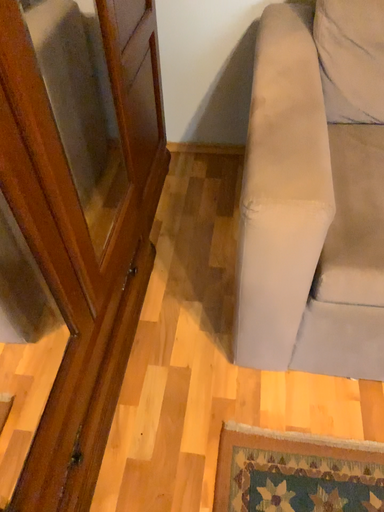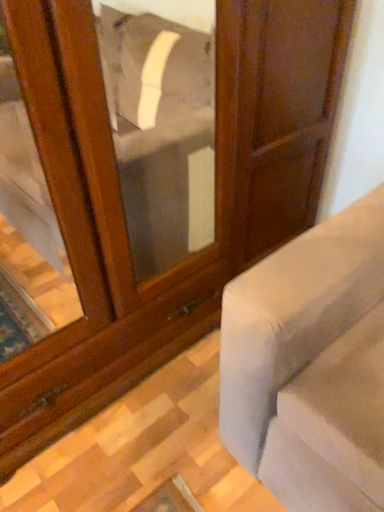
Question: Which way did the camera rotate in the video?

Choices:
 (A) rotated downward
 (B) rotated upward

Answer: (B)